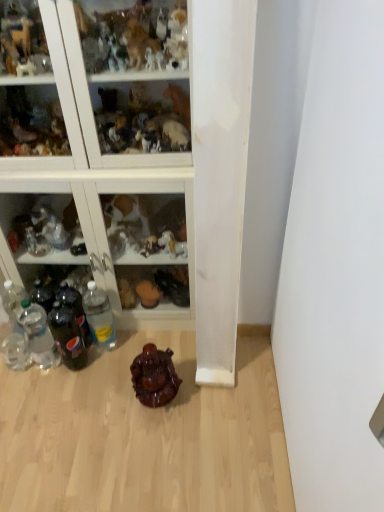
Locate an element on the screen. free space behind shiny brown statue at center is located at coordinates (169, 349).